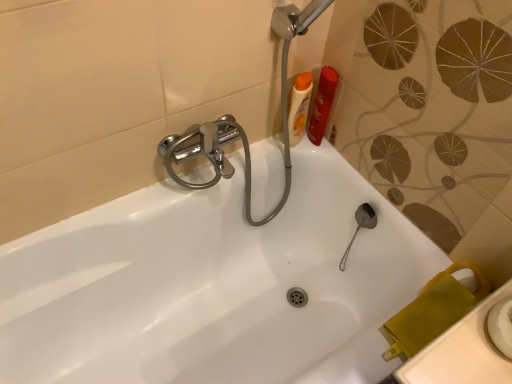
Question: From a real-world perspective, is matte plastic bottles at upper right, which is counted as the second toiletry, starting from the right, beneath orange plastic shampoo bottle at upper right, marked as the 2th toiletry in a left-to-right arrangement?

Choices:
 (A) yes
 (B) no

Answer: (B)

Question: Is matte plastic bottles at upper right, the 1th toiletry from the left, bigger than orange plastic shampoo bottle at upper right, marked as the 2th toiletry in a left-to-right arrangement?

Choices:
 (A) no
 (B) yes

Answer: (B)

Question: Does matte plastic bottles at upper right, which is counted as the second toiletry, starting from the right, appear on the left side of orange plastic shampoo bottle at upper right, marked as the 2th toiletry in a left-to-right arrangement?

Choices:
 (A) yes
 (B) no

Answer: (A)

Question: Can you confirm if matte plastic bottles at upper right, which is counted as the second toiletry, starting from the right, is taller than orange plastic shampoo bottle at upper right, marked as the 2th toiletry in a left-to-right arrangement?

Choices:
 (A) yes
 (B) no

Answer: (A)

Question: From a real-world perspective, is matte plastic bottles at upper right, the 1th toiletry from the left, on orange plastic shampoo bottle at upper right, acting as the 1th toiletry starting from the right?

Choices:
 (A) yes
 (B) no

Answer: (A)

Question: From the image's perspective, is matte plastic bottles at upper right, which is counted as the second toiletry, starting from the right, located beneath orange plastic shampoo bottle at upper right, acting as the 1th toiletry starting from the right?

Choices:
 (A) no
 (B) yes

Answer: (B)

Question: Does orange plastic shampoo bottle at upper right, marked as the 2th toiletry in a left-to-right arrangement, have a lesser height compared to matte plastic bottles at upper right, which is counted as the second toiletry, starting from the right?

Choices:
 (A) yes
 (B) no

Answer: (A)

Question: Considering the relative sizes of orange plastic shampoo bottle at upper right, acting as the 1th toiletry starting from the right, and matte plastic bottles at upper right, which is counted as the second toiletry, starting from the right, in the image provided, is orange plastic shampoo bottle at upper right, acting as the 1th toiletry starting from the right, smaller than matte plastic bottles at upper right, which is counted as the second toiletry, starting from the right,?

Choices:
 (A) yes
 (B) no

Answer: (A)

Question: Is orange plastic shampoo bottle at upper right, acting as the 1th toiletry starting from the right, surrounding matte plastic bottles at upper right, the 1th toiletry from the left?

Choices:
 (A) yes
 (B) no

Answer: (B)

Question: Is orange plastic shampoo bottle at upper right, acting as the 1th toiletry starting from the right, oriented towards matte plastic bottles at upper right, which is counted as the second toiletry, starting from the right?

Choices:
 (A) yes
 (B) no

Answer: (B)

Question: Can you confirm if orange plastic shampoo bottle at upper right, marked as the 2th toiletry in a left-to-right arrangement, is taller than matte plastic bottles at upper right, which is counted as the second toiletry, starting from the right?

Choices:
 (A) no
 (B) yes

Answer: (A)

Question: From a real-world perspective, is orange plastic shampoo bottle at upper right, marked as the 2th toiletry in a left-to-right arrangement, below matte plastic bottles at upper right, the 1th toiletry from the left?

Choices:
 (A) yes
 (B) no

Answer: (A)

Question: Relative to orange plastic shampoo bottle at upper right, marked as the 2th toiletry in a left-to-right arrangement, is matte plastic bottles at upper right, the 1th toiletry from the left, in front or behind?

Choices:
 (A) behind
 (B) front

Answer: (B)